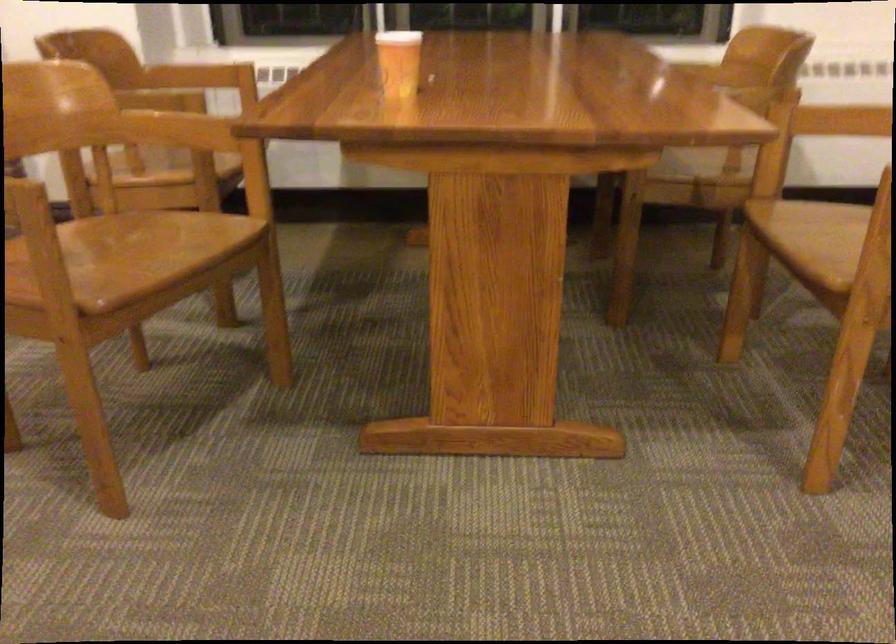
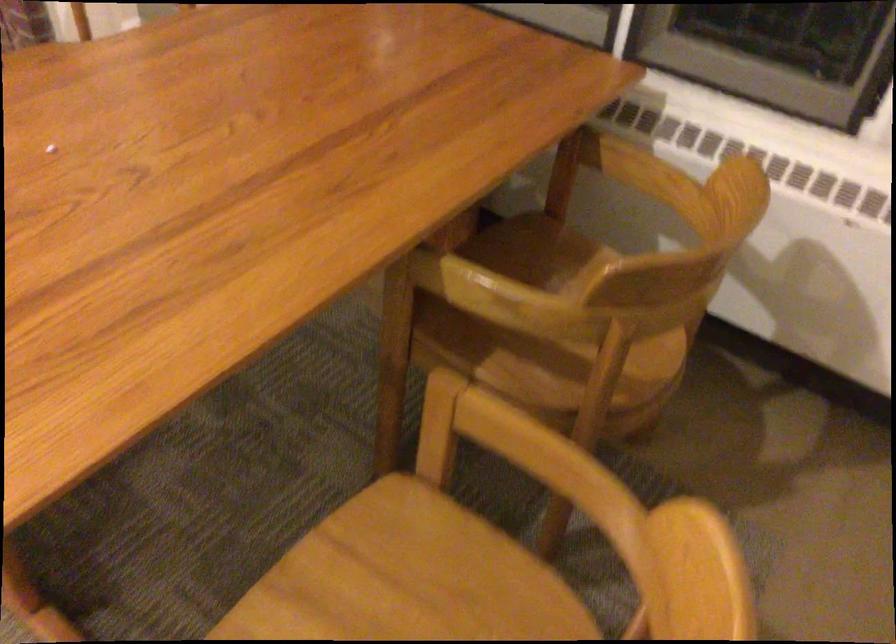
Where in the second image is the point corresponding to pixel 817 120 from the first image?

(501, 440)